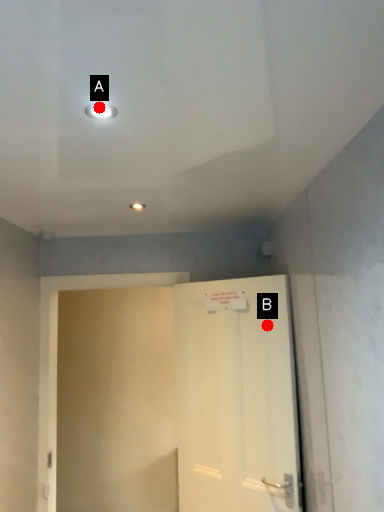
Question: Two points are circled on the image, labeled by A and B beside each circle. Which point is further to the camera?

Choices:
 (A) A is further
 (B) B is further

Answer: (B)